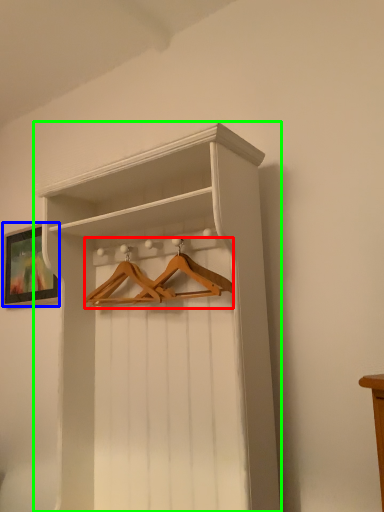
Question: Which is nearer to the hanger (highlighted by a red box)? picture frame (highlighted by a blue box) or shelf (highlighted by a green box).

Choices:
 (A) picture frame
 (B) shelf

Answer: (B)